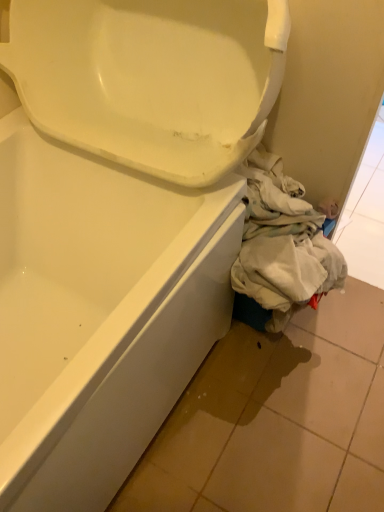
I want to click on light beige fabric at lower right, so click(281, 249).

What do you see at coordinates (281, 249) in the screenshot? The width and height of the screenshot is (384, 512). I see `light beige fabric at lower right` at bounding box center [281, 249].

Where is `matte white tile at lower right`? The width and height of the screenshot is (384, 512). matte white tile at lower right is located at coordinates (267, 414).

Describe the element at coordinates (267, 414) in the screenshot. The width and height of the screenshot is (384, 512). I see `matte white tile at lower right` at that location.

The width and height of the screenshot is (384, 512). Find the location of `light beige fabric at lower right`. light beige fabric at lower right is located at coordinates (281, 249).

Does matte white tile at lower right appear on the left side of light beige fabric at lower right?

In fact, matte white tile at lower right is to the right of light beige fabric at lower right.

Is matte white tile at lower right further to camera compared to light beige fabric at lower right?

That is False.

Is point (211, 442) farther from viewer compared to point (300, 227)?

Yes, it is.

From the image's perspective, which object appears higher, matte white tile at lower right or light beige fabric at lower right?

light beige fabric at lower right is shown above in the image.

From a real-world perspective, which is physically above, matte white tile at lower right or light beige fabric at lower right?

From a 3D spatial view, light beige fabric at lower right is above.

In terms of width, does matte white tile at lower right look wider or thinner when compared to light beige fabric at lower right?

Considering their sizes, matte white tile at lower right looks broader than light beige fabric at lower right.

Who is shorter, matte white tile at lower right or light beige fabric at lower right?

With less height is matte white tile at lower right.

Who is bigger, matte white tile at lower right or light beige fabric at lower right?

Bigger between the two is matte white tile at lower right.

Would you say light beige fabric at lower right is part of matte white tile at lower right's contents?

No.

Is matte white tile at lower right placed right next to light beige fabric at lower right?

No, matte white tile at lower right is not touching light beige fabric at lower right.

Is matte white tile at lower right facing towards light beige fabric at lower right?

No, matte white tile at lower right is not turned towards light beige fabric at lower right.

Find the location of `tile that is in front of the light beige fabric at lower right`. tile that is in front of the light beige fabric at lower right is located at coordinates (267, 414).

Which object is positioned more to the right, light beige fabric at lower right or matte white tile at lower right?

Positioned to the right is matte white tile at lower right.

Based on the photo, is the position of light beige fabric at lower right less distant than that of matte white tile at lower right?

No, light beige fabric at lower right is behind matte white tile at lower right.

Is point (265, 266) farther from viewer compared to point (235, 388)?

No, (265, 266) is in front of (235, 388).

From the image's perspective, between light beige fabric at lower right and matte white tile at lower right, who is located below?

matte white tile at lower right is shown below in the image.

From a real-world perspective, is light beige fabric at lower right positioned above or below matte white tile at lower right?

In terms of real-world spatial position, light beige fabric at lower right is above matte white tile at lower right.

In terms of width, does light beige fabric at lower right look wider or thinner when compared to matte white tile at lower right?

light beige fabric at lower right is thinner than matte white tile at lower right.

Who is shorter, light beige fabric at lower right or matte white tile at lower right?

With less height is matte white tile at lower right.

Can you confirm if light beige fabric at lower right is bigger than matte white tile at lower right?

Incorrect, light beige fabric at lower right is not larger than matte white tile at lower right.

Which is correct: light beige fabric at lower right is inside matte white tile at lower right, or outside of it?

light beige fabric at lower right cannot be found inside matte white tile at lower right.

Is there a large distance between light beige fabric at lower right and matte white tile at lower right?

They are positioned close to each other.

Consider the image. Could you tell me if light beige fabric at lower right is turned towards matte white tile at lower right?

No.

Identify the location of clothing located on the left of matte white tile at lower right. (281, 249).

Where is `tile on the right side of light beige fabric at lower right`? This screenshot has height=512, width=384. tile on the right side of light beige fabric at lower right is located at coordinates (267, 414).

Image resolution: width=384 pixels, height=512 pixels. What are the coordinates of `clothing lying above the matte white tile at lower right (from the image's perspective)` in the screenshot? It's located at point(281,249).